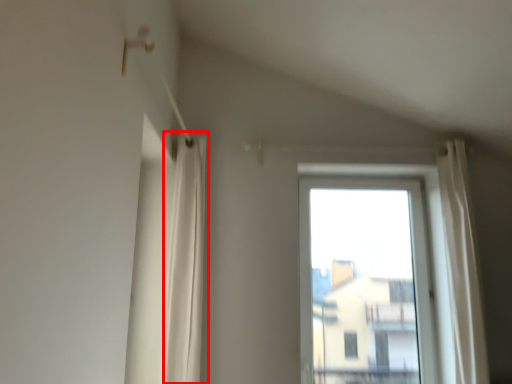
Question: From the image's perspective, considering the relative positions of shower curtain (annotated by the red box) and window in the image provided, where is shower curtain (annotated by the red box) located with respect to the staircase?

Choices:
 (A) above
 (B) below

Answer: (A)